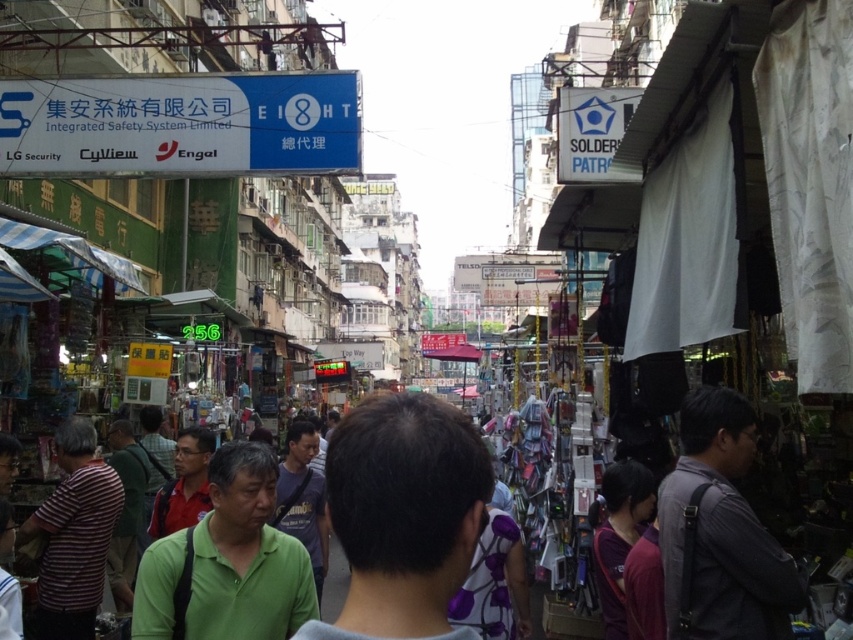
Question: Which point is closer to the camera?

Choices:
 (A) dark green shirt at center
 (B) dark gray shirt at center
 (C) green textured shirt at center

Answer: (A)

Question: Considering the real-world distances, which object is farthest from the dark gray shirt at center?

Choices:
 (A) dark green shirt at center
 (B) striped fabric shirt at lower left
 (C) green textured shirt at center

Answer: (B)

Question: Where is dark green shirt at center located in relation to green textured shirt at center in the image?

Choices:
 (A) left
 (B) right

Answer: (B)

Question: Can you confirm if dark green shirt at center is positioned above striped fabric shirt at lower left?

Choices:
 (A) no
 (B) yes

Answer: (A)

Question: Among these objects, which one is farthest from the camera?

Choices:
 (A) green textured shirt at center
 (B) dark green shirt at center
 (C) striped fabric shirt at lower left

Answer: (C)

Question: Can you confirm if dark gray shirt at center is bigger than green textured shirt at center?

Choices:
 (A) yes
 (B) no

Answer: (B)